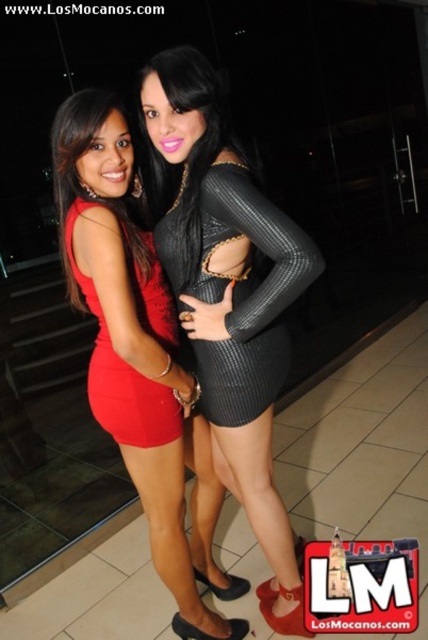
You are a photographer setting up a shoot for two models wearing the black ribbed dress at center and the matte red dress at left. Since you want to emphasize the size difference between their outfits, which dress should you place closer to the camera to make it appear larger?

The black ribbed dress at center is already bigger than the matte red dress at left, so to emphasize the size difference, you should place the matte red dress at left closer to the camera. This way, the smaller dress will appear larger in comparison, making the size difference between the two more noticeable.

You are a photographer setting up a lighting setup for a photoshoot. You notice two dresses in the scene, the shiny black dress at center and the matte black dress at center. Which dress should you position closer to the light source to highlight its reflective surface?

The shiny black dress at center has a greater height compared to matte black dress at center. Therefore, positioning the shiny black dress at center closer to the light source will better highlight its reflective surface due to its taller height allowing more surface area to catch the light.

You are standing in the image and want to find the point at coordinates (x=231, y=300). Which object is this point located on?

The point at coordinates (x=231, y=300) is located on the shiny black dress at center.